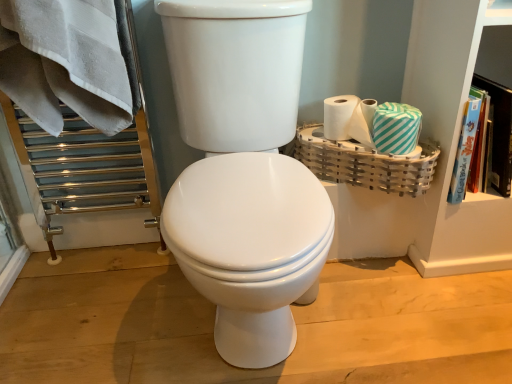
Question: Is bamboo basket at right located outside white glossy toilet at center?

Choices:
 (A) yes
 (B) no

Answer: (A)

Question: Considering the relative sizes of bamboo basket at right and white glossy toilet at center in the image provided, is bamboo basket at right shorter than white glossy toilet at center?

Choices:
 (A) no
 (B) yes

Answer: (B)

Question: From the image's perspective, does bamboo basket at right appear lower than white glossy toilet at center?

Choices:
 (A) yes
 (B) no

Answer: (B)

Question: Is bamboo basket at right to the left of white glossy toilet at center from the viewer's perspective?

Choices:
 (A) no
 (B) yes

Answer: (A)

Question: Is bamboo basket at right aimed at white glossy toilet at center?

Choices:
 (A) yes
 (B) no

Answer: (A)

Question: Considering the relative sizes of bamboo basket at right and white glossy toilet at center in the image provided, is bamboo basket at right wider than white glossy toilet at center?

Choices:
 (A) yes
 (B) no

Answer: (B)

Question: Is white glossy toilet at center not near teal striped tissue at right?

Choices:
 (A) yes
 (B) no

Answer: (B)

Question: Is teal striped tissue at right a part of white glossy toilet at center?

Choices:
 (A) yes
 (B) no

Answer: (B)

Question: Is white glossy toilet at center not inside teal striped tissue at right?

Choices:
 (A) no
 (B) yes

Answer: (B)

Question: Does white glossy toilet at center appear on the right side of teal striped tissue at right?

Choices:
 (A) yes
 (B) no

Answer: (B)

Question: From the image's perspective, is white glossy toilet at center located above teal striped tissue at right?

Choices:
 (A) yes
 (B) no

Answer: (B)

Question: From a real-world perspective, is white glossy toilet at center positioned over teal striped tissue at right based on gravity?

Choices:
 (A) no
 (B) yes

Answer: (A)

Question: Is teal striped tissue at right closer to the viewer compared to white glossy toilet at center?

Choices:
 (A) yes
 (B) no

Answer: (B)